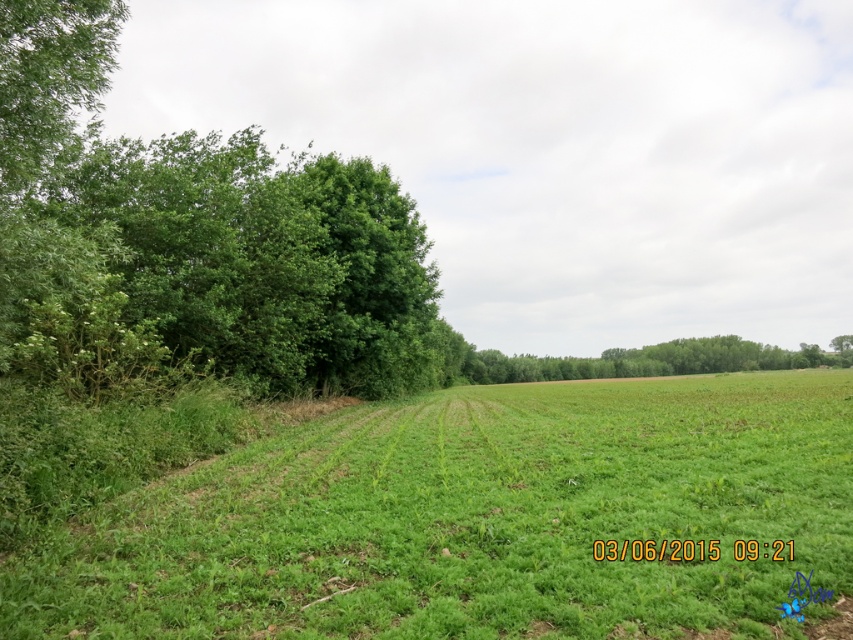
You are standing in the rural landscape and want to walk from the green grassy field at lower left to the green leafy tree at center. Which direction should you move to get closer to the tree?

To reach the green leafy tree at center from the green grassy field at lower left, you should move away from the viewer since the green leafy tree at center is further away than the green grassy field at lower left.

You are a farmer checking the field. You notice the green grassy field at lower left and the green leafy tree at left. Which one covers a larger area in the image?

The green leafy tree at left covers a larger area in the image compared to the green grassy field at lower left according to the description.